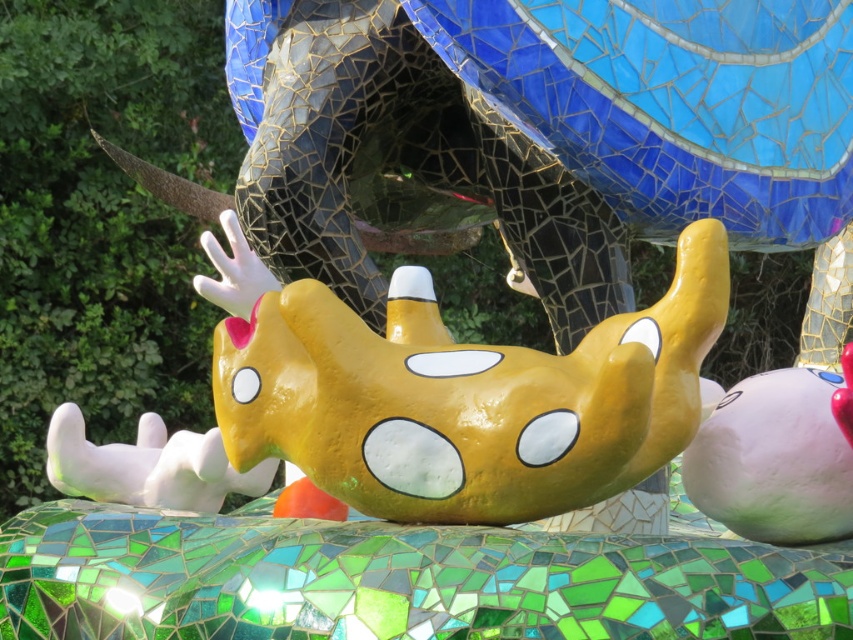
Question: Is yellow matte toy at center to the left of matte white plush at lower right from the viewer's perspective?

Choices:
 (A) yes
 (B) no

Answer: (A)

Question: Which of the following is the closest to the observer?

Choices:
 (A) matte white plush at lower right
 (B) white glossy paw at lower left

Answer: (A)

Question: Is yellow matte toy at center closer to camera compared to white glossy paw at lower left?

Choices:
 (A) yes
 (B) no

Answer: (A)

Question: Which object appears farthest from the camera in this image?

Choices:
 (A) yellow matte toy at center
 (B) matte white plush at lower right

Answer: (B)

Question: Which of the following is the closest to the observer?

Choices:
 (A) matte white plush at lower right
 (B) yellow matte toy at center

Answer: (B)

Question: Is yellow matte toy at center in front of matte white plush at lower right?

Choices:
 (A) no
 (B) yes

Answer: (B)